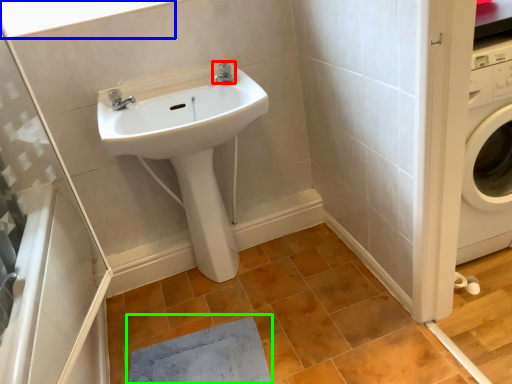
Question: Estimate the real-world distances between objects in this image. Which object is farther from tap (highlighted by a red box), window (highlighted by a blue box) or doormat (highlighted by a green box)?

Choices:
 (A) window
 (B) doormat

Answer: (B)